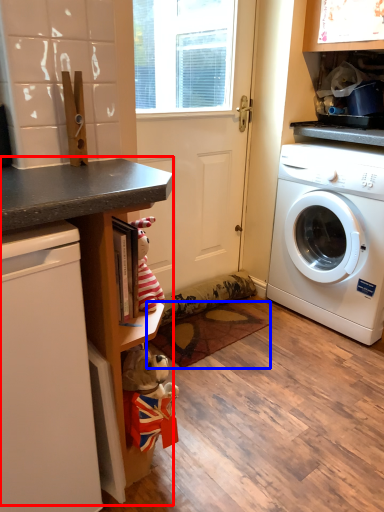
Question: Which object is further to the camera taking this photo, counter (highlighted by a red box) or mat (highlighted by a blue box)?

Choices:
 (A) counter
 (B) mat

Answer: (B)